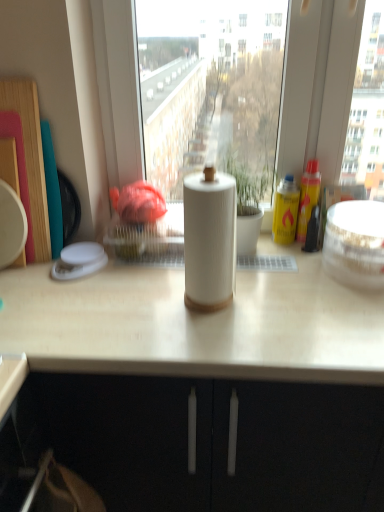
Question: Can you confirm if white glossy bowl at right, placed as the 1th appliance when sorted from right to left, is shorter than white matte paper towel holder at center?

Choices:
 (A) no
 (B) yes

Answer: (B)

Question: Can you confirm if white glossy bowl at right, placed as the 1th appliance when sorted from right to left, is positioned to the left of white matte paper towel holder at center?

Choices:
 (A) yes
 (B) no

Answer: (B)

Question: Does white glossy bowl at right, placed as the 1th appliance when sorted from right to left, appear on the right side of white matte paper towel holder at center?

Choices:
 (A) yes
 (B) no

Answer: (A)

Question: Can you confirm if white glossy bowl at right, placed as the 1th appliance when sorted from right to left, is thinner than white matte paper towel holder at center?

Choices:
 (A) yes
 (B) no

Answer: (A)

Question: Is white glossy bowl at right, which is the 2th appliance from left to right, positioned far away from white matte paper towel holder at center?

Choices:
 (A) yes
 (B) no

Answer: (B)

Question: Is white matte paper towel holder at center situated inside white plastic container at left, the first appliance viewed from the left, or outside?

Choices:
 (A) inside
 (B) outside

Answer: (B)

Question: From the image's perspective, relative to white plastic container at left, the 2th appliance in the right-to-left sequence, is white matte paper towel holder at center above or below?

Choices:
 (A) above
 (B) below

Answer: (B)

Question: Is white matte paper towel holder at center bigger or smaller than white plastic container at left, the first appliance viewed from the left?

Choices:
 (A) big
 (B) small

Answer: (A)

Question: In terms of width, does white matte paper towel holder at center look wider or thinner when compared to white plastic container at left, the 2th appliance in the right-to-left sequence?

Choices:
 (A) wide
 (B) thin

Answer: (A)

Question: Looking at the image, does white matte paper towel at center seem bigger or smaller compared to white plastic container at left, the 2th appliance in the right-to-left sequence?

Choices:
 (A) big
 (B) small

Answer: (A)

Question: From the image's perspective, is white matte paper towel at center positioned above or below white plastic container at left, the 2th appliance in the right-to-left sequence?

Choices:
 (A) below
 (B) above

Answer: (B)

Question: From a real-world perspective, is white matte paper towel at center above or below white plastic container at left, the 2th appliance in the right-to-left sequence?

Choices:
 (A) below
 (B) above

Answer: (B)

Question: Is white matte paper towel at center taller or shorter than white plastic container at left, the 2th appliance in the right-to-left sequence?

Choices:
 (A) short
 (B) tall

Answer: (B)

Question: From the image's perspective, is white glossy bowl at right, placed as the 1th appliance when sorted from right to left, positioned above or below white matte paper towel holder at center?

Choices:
 (A) below
 (B) above

Answer: (B)

Question: In the image, is white glossy bowl at right, which is the 2th appliance from left to right, positioned in front of or behind white matte paper towel holder at center?

Choices:
 (A) behind
 (B) front

Answer: (A)